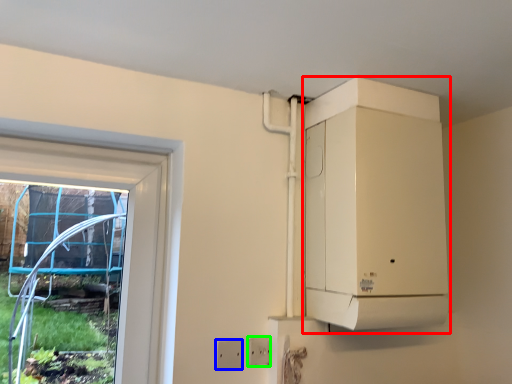
Question: Which object is the closest to the appliance (highlighted by a red box)? Choose among these: electric outlet (highlighted by a blue box) or electric outlet (highlighted by a green box).

Choices:
 (A) electric outlet
 (B) electric outlet

Answer: (B)